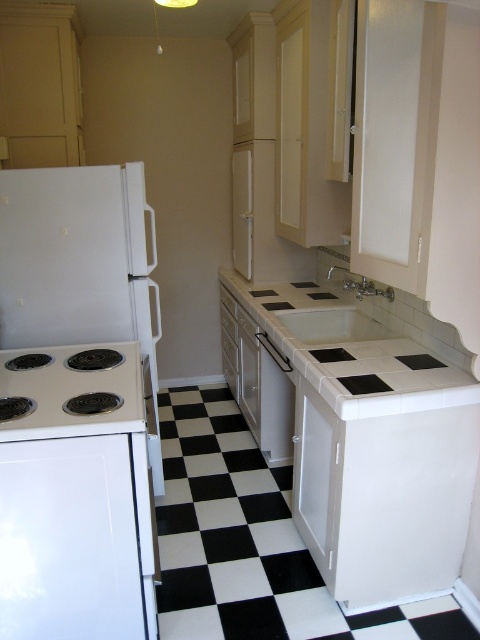
You are a chef preparing to place a large cutting board on the white tile countertop at center. However, you notice the satin silver dishwasher at center is directly behind the countertop. Will the dishwasher interfere with placing the board on the countertop?

The white tile countertop at center is in front of the satin silver dishwasher at center, so placing the cutting board on the countertop won not interfere with the dishwasher since it is positioned in front of it.

You are organizing a dinner party and need to place a large platter on the kitchen counter. Given the space constraints, can the white glossy refrigerator at left and the white tile countertop at center accommodate the platter without overlapping?

The white glossy refrigerator at left has a lesser width compared to the white tile countertop at center, so the platter can be placed on the white tile countertop at center since it is wider and provides more space.